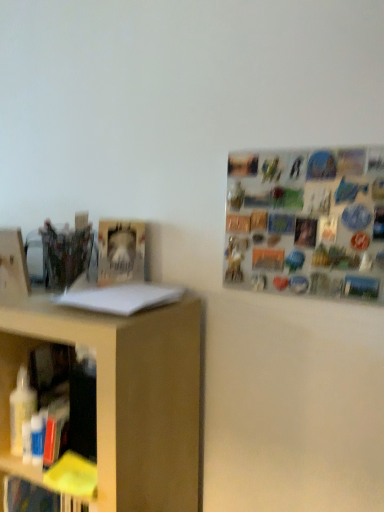
I want to click on white paper at left, the 2th book viewed from the top, so click(x=120, y=297).

From a real-world perspective, which book is the 1st one underneath the metallic silver magnets at upper right? Please provide its 2D coordinates.

[(120, 252)]

Is hardcover book at center-left, arranged as the second book when viewed from the front, positioned before metallic silver magnets at upper right?

That is False.

Is hardcover book at center-left, which appears as the second book when ordered from the bottom, positioned far away from metallic silver magnets at upper right?

No, hardcover book at center-left, which appears as the second book when ordered from the bottom, is in close proximity to metallic silver magnets at upper right.

Does hardcover book at center-left, which appears as the second book when ordered from the bottom, have a larger size compared to white paper at left, arranged as the 1th book when viewed from the front?

Indeed, hardcover book at center-left, which appears as the second book when ordered from the bottom, has a larger size compared to white paper at left, arranged as the 1th book when viewed from the front.

Can you confirm if hardcover book at center-left, which is the first book from top to bottom, is positioned to the right of white paper at left, arranged as the 1th book when viewed from the front?

No.

Is hardcover book at center-left, the first book in the back-to-front sequence, not near white paper at left, arranged as the 1th book when viewed from the front?

No, hardcover book at center-left, the first book in the back-to-front sequence, is not far from white paper at left, arranged as the 1th book when viewed from the front.

Who is taller, hardcover book at center-left, which is the first book from top to bottom, or white paper at left, which is counted as the 2th book, starting from the back?

With more height is hardcover book at center-left, which is the first book from top to bottom.

Consider the image. Does white paper at left, the first book in the bottom-to-top sequence, have a smaller size compared to metallic silver magnets at upper right?

Yes.

From a real-world perspective, who is located lower, white paper at left, arranged as the 1th book when viewed from the front, or metallic silver magnets at upper right?

In real-world perspective, white paper at left, arranged as the 1th book when viewed from the front, is lower.

Is metallic silver magnets at upper right at the back of white paper at left, arranged as the 1th book when viewed from the front?

No, white paper at left, arranged as the 1th book when viewed from the front, is not facing away from metallic silver magnets at upper right.

Is the position of white paper at left, the first book in the bottom-to-top sequence, more distant than that of metallic silver magnets at upper right?

No, white paper at left, the first book in the bottom-to-top sequence, is closer to the viewer.

Could you measure the distance between metallic silver magnets at upper right and white paper at left, which is counted as the 2th book, starting from the back?

metallic silver magnets at upper right is 14.52 inches from white paper at left, which is counted as the 2th book, starting from the back.

Is metallic silver magnets at upper right not close to white paper at left, arranged as the 1th book when viewed from the front?

They are positioned close to each other.

Locate an element on the screen. The image size is (384, 512). bulletin board located above the white paper at left, arranged as the 1th book when viewed from the front (from a real-world perspective) is located at coordinates (306, 222).

From the image's perspective, which one is positioned lower, metallic silver magnets at upper right or white paper at left, the 2th book viewed from the top?

white paper at left, the 2th book viewed from the top.

I want to click on bulletin board above the hardcover book at center-left, arranged as the second book when viewed from the front (from a real-world perspective), so click(306, 222).

From a real-world perspective, is metallic silver magnets at upper right on top of hardcover book at center-left, arranged as the second book when viewed from the front?

Yes, from a real-world perspective, metallic silver magnets at upper right is on top of hardcover book at center-left, arranged as the second book when viewed from the front.

Is metallic silver magnets at upper right aimed at hardcover book at center-left, the first book in the back-to-front sequence?

No, metallic silver magnets at upper right is not oriented towards hardcover book at center-left, the first book in the back-to-front sequence.

Who is shorter, metallic silver magnets at upper right or hardcover book at center-left, which is the first book from top to bottom?

With less height is hardcover book at center-left, which is the first book from top to bottom.

Who is more distant, white paper at left, which is counted as the 2th book, starting from the back, or hardcover book at center-left, which is the first book from top to bottom?

hardcover book at center-left, which is the first book from top to bottom, is further from the camera.

Can you confirm if white paper at left, which is counted as the 2th book, starting from the back, is wider than hardcover book at center-left, arranged as the second book when viewed from the front?

Correct, the width of white paper at left, which is counted as the 2th book, starting from the back, exceeds that of hardcover book at center-left, arranged as the second book when viewed from the front.

How many degrees apart are the facing directions of white paper at left, the 2th book viewed from the top, and hardcover book at center-left, arranged as the second book when viewed from the front?

38.9 degrees.

Between white paper at left, the 2th book viewed from the top, and hardcover book at center-left, the first book in the back-to-front sequence, which one appears on the left side from the viewer's perspective?

Positioned to the left is hardcover book at center-left, the first book in the back-to-front sequence.

Identify the location of the 1st book below when counting from the metallic silver magnets at upper right (from the image's perspective). (120, 252).

At what (x,y) coordinates should I click in order to perform the action: click on book on the right of hardcover book at center-left, which appears as the second book when ordered from the bottom. Please return your answer as a coordinate pair (x, y). The image size is (384, 512). Looking at the image, I should click on (120, 297).

When comparing their distances from hardcover book at center-left, which is the first book from top to bottom, does metallic silver magnets at upper right or white paper at left, which is counted as the 2th book, starting from the back, seem closer?

Based on the image, white paper at left, which is counted as the 2th book, starting from the back, appears to be nearer to hardcover book at center-left, which is the first book from top to bottom.

When comparing their distances from hardcover book at center-left, arranged as the second book when viewed from the front, does white paper at left, arranged as the 1th book when viewed from the front, or metallic silver magnets at upper right seem closer?

white paper at left, arranged as the 1th book when viewed from the front.

From the image, which object appears to be nearer to metallic silver magnets at upper right, hardcover book at center-left, arranged as the second book when viewed from the front, or white paper at left, which is counted as the 2th book, starting from the back?

Among the two, white paper at left, which is counted as the 2th book, starting from the back, is located nearer to metallic silver magnets at upper right.

Consider the image. Looking at the image, which one is located further to white paper at left, the first book in the bottom-to-top sequence, metallic silver magnets at upper right or hardcover book at center-left, which appears as the second book when ordered from the bottom?

metallic silver magnets at upper right lies further to white paper at left, the first book in the bottom-to-top sequence, than the other object.

Considering their positions, is white paper at left, the 2th book viewed from the top, positioned closer to metallic silver magnets at upper right than hardcover book at center-left, the first book in the back-to-front sequence?

Among the two, white paper at left, the 2th book viewed from the top, is located nearer to metallic silver magnets at upper right.

When comparing their distances from white paper at left, the 2th book viewed from the top, does hardcover book at center-left, arranged as the second book when viewed from the front, or metallic silver magnets at upper right seem closer?

Based on the image, hardcover book at center-left, arranged as the second book when viewed from the front, appears to be nearer to white paper at left, the 2th book viewed from the top.

I want to click on book between hardcover book at center-left, the first book in the back-to-front sequence, and metallic silver magnets at upper right, in the horizontal direction, so click(x=120, y=297).